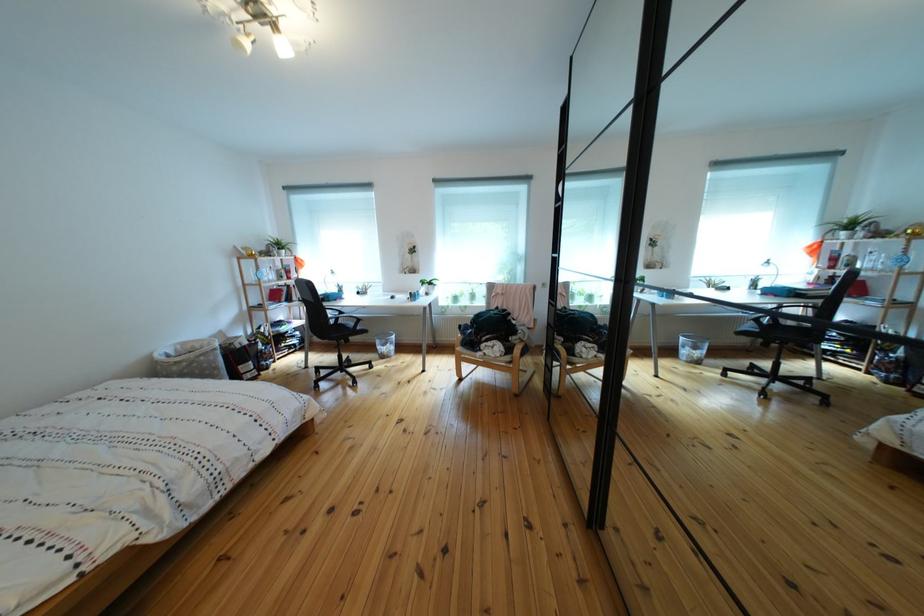
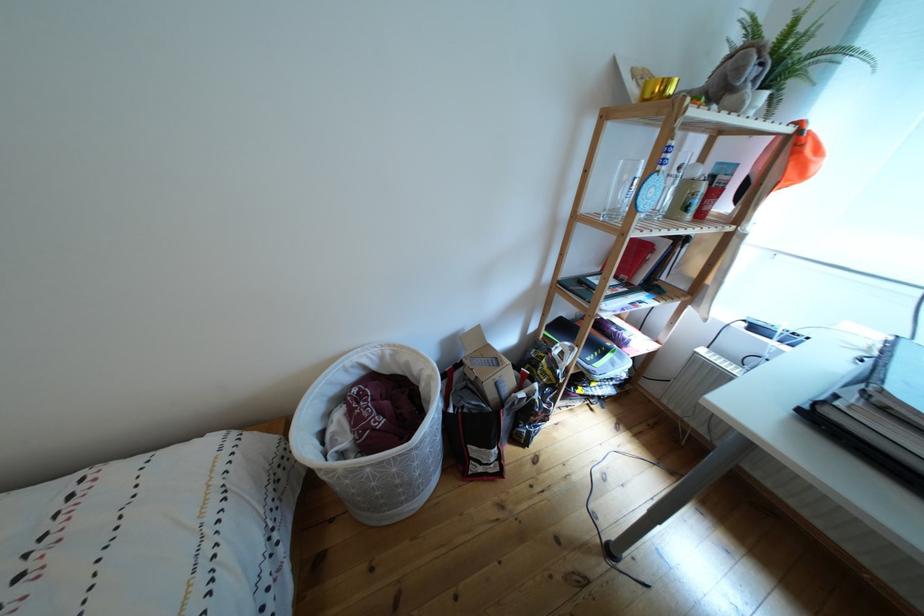
In the second image, find the point that corresponds to [187,355] in the first image.

(393, 363)